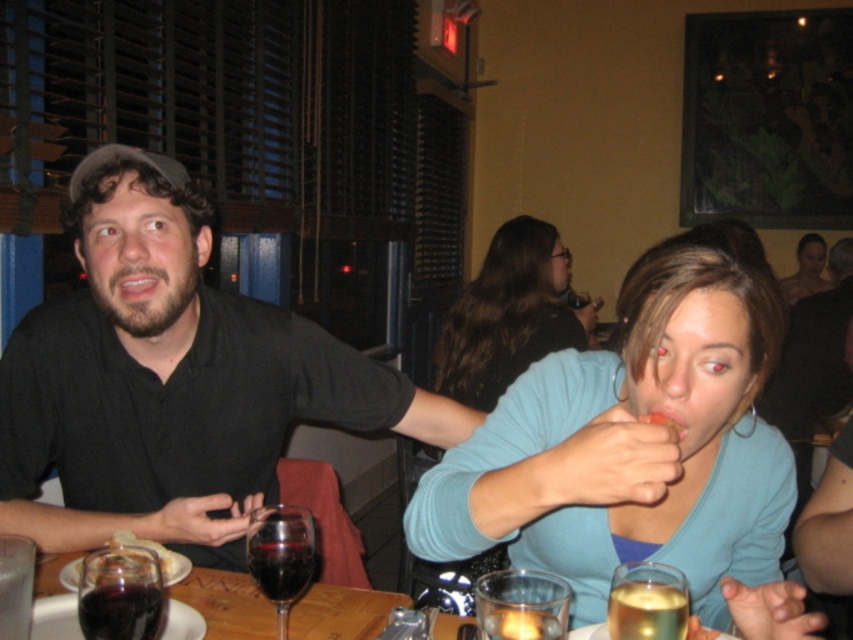
Does translucent glass wine glass at lower left have a greater width compared to translucent glass candle at lower center?

Yes, translucent glass wine glass at lower left is wider than translucent glass candle at lower center.

Can you confirm if translucent glass wine glass at lower left is shorter than translucent glass candle at lower center?

No, translucent glass wine glass at lower left is not shorter than translucent glass candle at lower center.

Who is more forward, (157, 560) or (488, 628)?

Point (488, 628)

The height and width of the screenshot is (640, 853). In order to click on translucent glass wine glass at lower left in this screenshot , I will do `click(120, 593)`.

Is brown hair at center below translucent glass at lower right?

No, brown hair at center is not below translucent glass at lower right.

Does brown hair at center come behind translucent glass at lower right?

Yes, brown hair at center is further from the viewer.

Is point (483, 362) more distant than point (627, 584)?

Yes, point (483, 362) is farther from viewer.

You are a GUI agent. You are given a task and a screenshot of the screen. Output one action in this format:
    pyautogui.click(x=<x>, y=<y>)
    Task: Click on the brown hair at center
    
    Given the screenshot: What is the action you would take?
    pyautogui.click(x=508, y=314)

What do you see at coordinates (120, 593) in the screenshot?
I see `translucent glass wine glass at lower left` at bounding box center [120, 593].

I want to click on translucent glass wine glass at lower left, so click(120, 593).